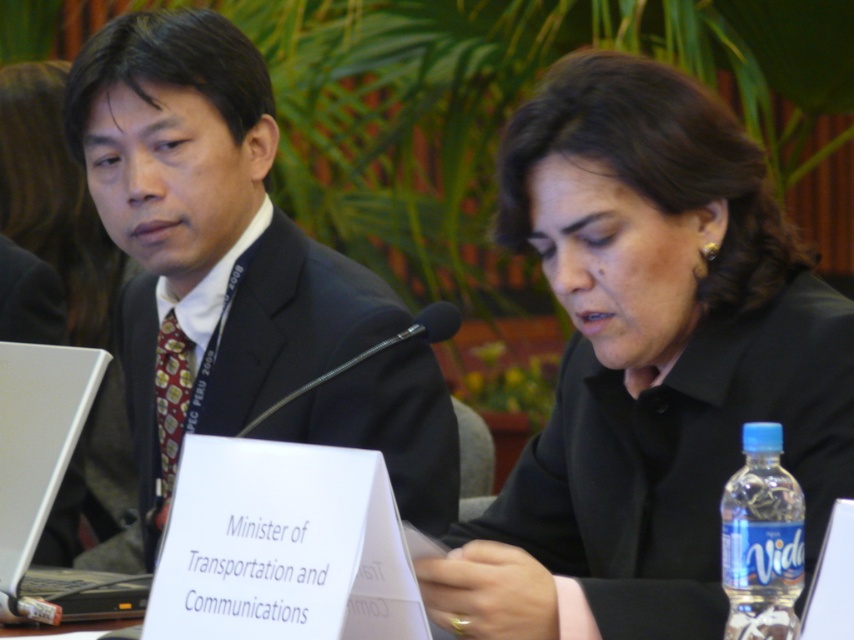
You are attending a virtual meeting and see the image. You need to send a file to the person wearing the dark suit at center. The file is on the silver metallic laptop at left. Can you directly send the file from the laptop to the person without moving the laptop? Explain why based on their positions.

The dark suit at center is located above the silver metallic laptop at left. Since the laptop is below the person wearing the dark suit, the file can be directly sent from the laptop to the person without needing to move the laptop because they are positioned in a way that allows access or transfer from that location.

You are standing in front of the conference table. Where is the black matte shirt at center located in terms of coordinates?

The black matte shirt at center is located at coordinates point (647,362).

You are organizing a photo shoot and need to ensure that all objects in the frame are visible. Given that the dark suit at center and the silver metallic laptop at left are both in the shot, which object would require more space in the frame to maintain clarity?

The dark suit at center requires more space in the frame because it has a larger size compared to the silver metallic laptop at left.